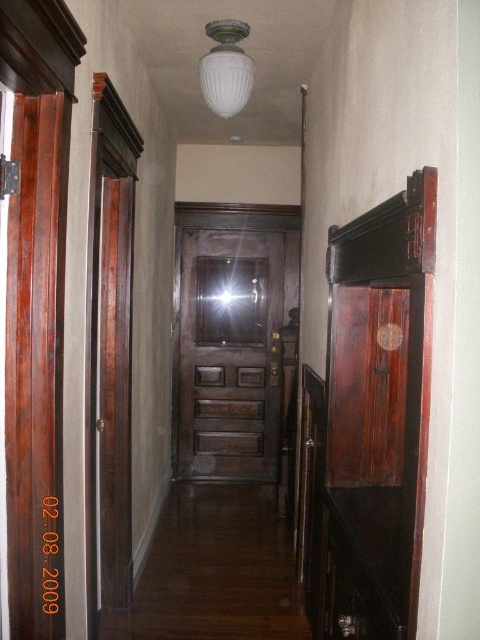
Question: Where is dark wood door at center located in relation to white frosted glass light fixture at upper center in the image?

Choices:
 (A) above
 (B) below

Answer: (B)

Question: Which object is positioned farthest from the dark wood door at center?

Choices:
 (A) white frosted glass light fixture at upper center
 (B) mahogany wood door at left

Answer: (A)

Question: Among these points, which one is nearest to the camera?

Choices:
 (A) (217, 77)
 (B) (93, 337)

Answer: (B)

Question: Can you confirm if mahogany wood door at left is smaller than white frosted glass light fixture at upper center?

Choices:
 (A) yes
 (B) no

Answer: (B)

Question: Can you confirm if dark wood door at center is positioned above mahogany wood door at left?

Choices:
 (A) no
 (B) yes

Answer: (B)

Question: Which object is positioned farthest from the dark wood door at center?

Choices:
 (A) mahogany wood door at left
 (B) white frosted glass light fixture at upper center

Answer: (B)